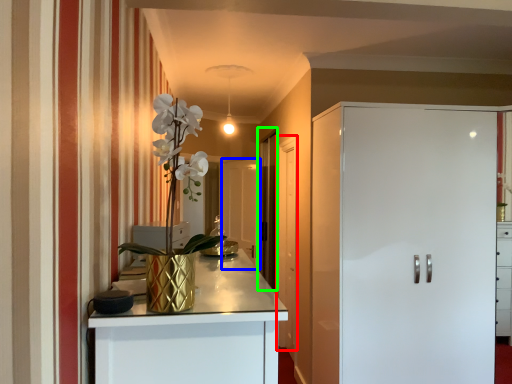
Question: Considering the real-world distances, which object is closest to door (highlighted by a red box)? glass door (highlighted by a blue box) or glass door (highlighted by a green box).

Choices:
 (A) glass door
 (B) glass door

Answer: (B)